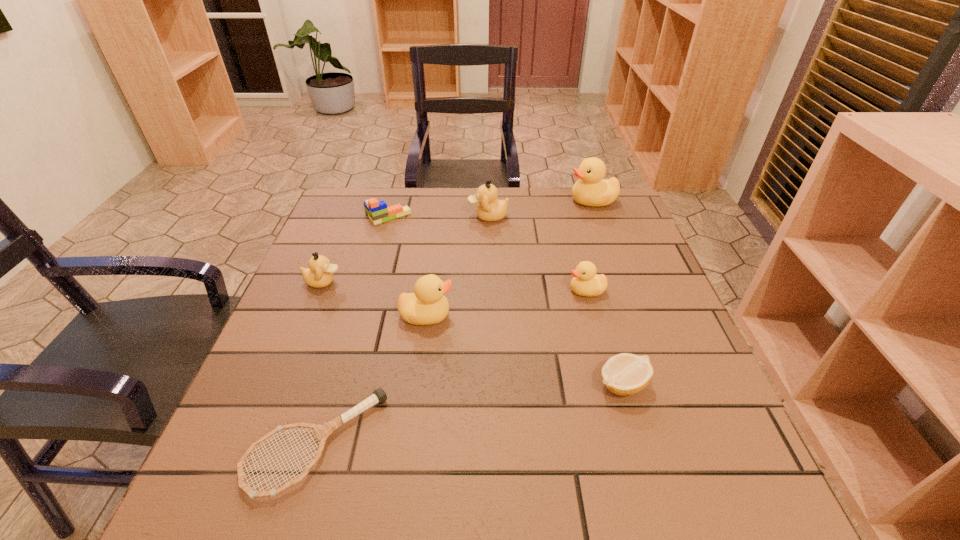
I want to click on vacant point located 0.390m on the face of the second biggest yellow duckling, so click(x=626, y=316).

Locate an element on the screen. vacant area situated 0.340m on the face of the nearer tan duckling is located at coordinates pyautogui.click(x=481, y=282).

This screenshot has height=540, width=960. I want to click on free space located on the face of the smallest yellow duckling, so click(546, 291).

Identify the location of free location located on the face of the smallest yellow duckling. The width and height of the screenshot is (960, 540). (429, 291).

At what (x,y) coordinates should I click in order to perform the action: click on vacant position located on the face of the smallest yellow duckling. Please return your answer as a coordinate pair (x, y). Looking at the image, I should click on (438, 291).

Find the location of a particular element. The width and height of the screenshot is (960, 540). blank space located on the left of the Lego is located at coordinates (330, 217).

The image size is (960, 540). Identify the location of vacant space located 0.150m on the front of the seventh tallest object. (651, 486).

Where is `blank space located on the right of the tennis racket`? This screenshot has width=960, height=540. blank space located on the right of the tennis racket is located at coordinates (601, 443).

Identify the location of Lego located in the far edge section of the desktop. (377, 211).

Locate an element on the screen. This screenshot has height=540, width=960. object that is positioned at the near edge is located at coordinates (322, 431).